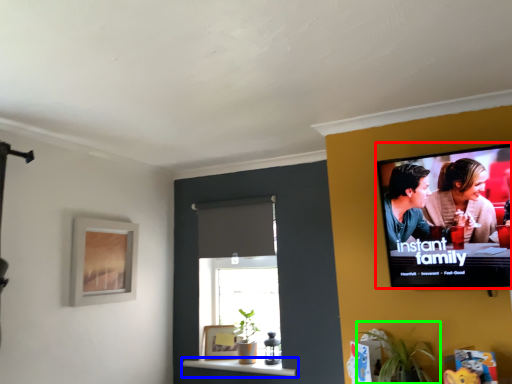
Question: Which object is positioned closest to television (highlighted by a red box)? Select from window sill (highlighted by a blue box) and houseplant (highlighted by a green box).

Choices:
 (A) window sill
 (B) houseplant

Answer: (B)